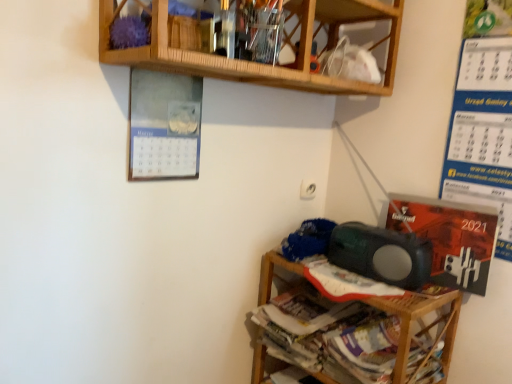
Question: Considering the positions of matte green speaker at lower right and wooden shelf at lower right, which ranks as the 1th shelf in bottom-to-top order, in the image, is matte green speaker at lower right bigger or smaller than wooden shelf at lower right, which ranks as the 1th shelf in bottom-to-top order,?

Choices:
 (A) small
 (B) big

Answer: (A)

Question: Is matte green speaker at lower right taller or shorter than wooden shelf at lower right, the second shelf from the top?

Choices:
 (A) short
 (B) tall

Answer: (A)

Question: Which of these objects is positioned farthest from the matte green speaker at lower right?

Choices:
 (A) wooden at upper center, which is the second shelf in bottom-to-top order
 (B) blue knitted fabric at lower right
 (C) orange glossy calendar at lower right, the first writing in the bottom-to-top sequence
 (D) wooden shelf at lower right, the second shelf from the top
 (E) blue paper calendar at right, which is the 1th writing from top to bottom

Answer: (A)

Question: Which is farther from the orange glossy calendar at lower right, the 2th writing in the top-to-bottom sequence?

Choices:
 (A) blue paper calendar at right, which is the 1th writing from top to bottom
 (B) wooden at upper center, arranged as the 1th shelf when viewed from the top
 (C) blue knitted fabric at lower right
 (D) wooden shelf at lower right, which ranks as the 1th shelf in bottom-to-top order
 (E) matte green speaker at lower right

Answer: (B)